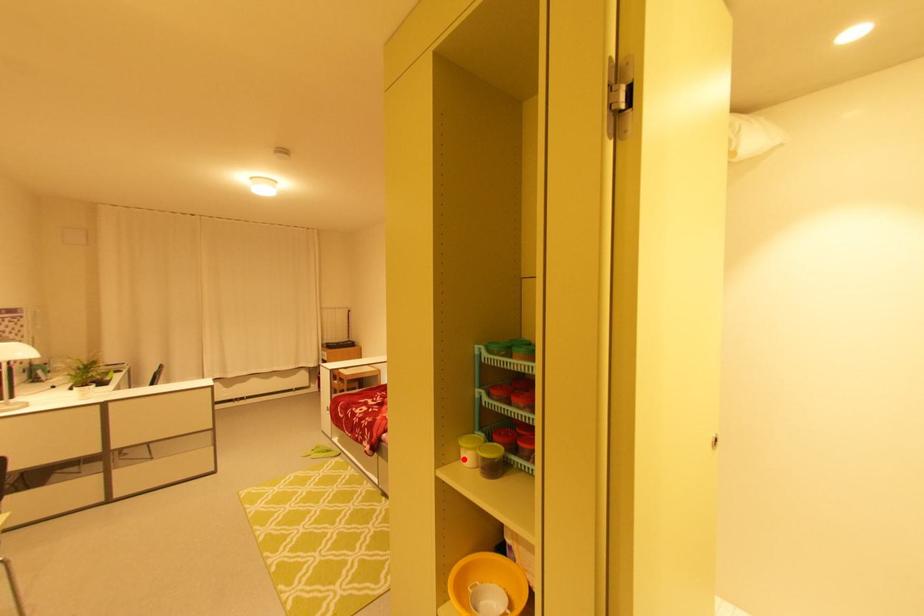
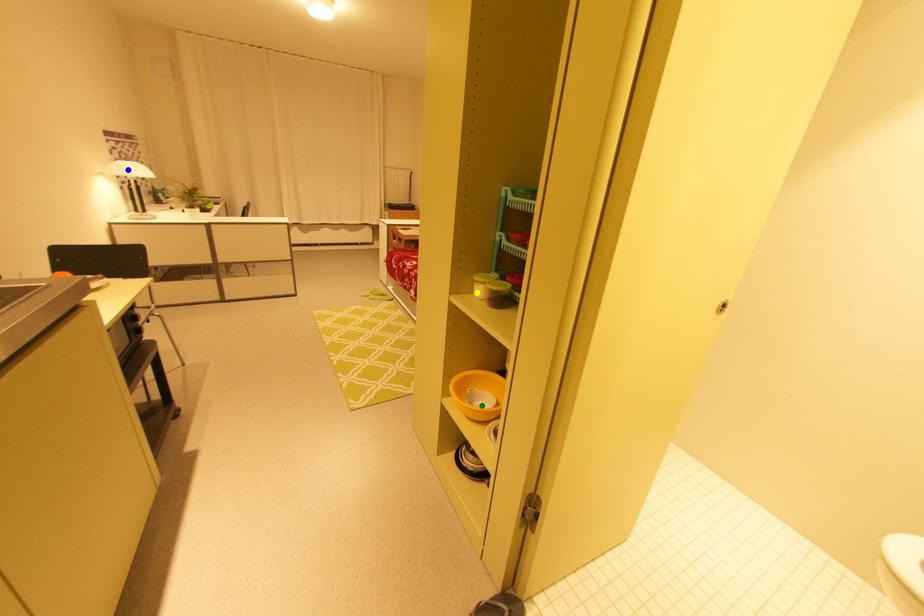
Question: I am providing you with two images of the same scene from different viewpoints. A red point is marked on the first image. You are given multiple points on the second image. Which mark in image 2 goes with the point in image 1?

Choices:
 (A) green point
 (B) blue point
 (C) yellow point

Answer: (C)